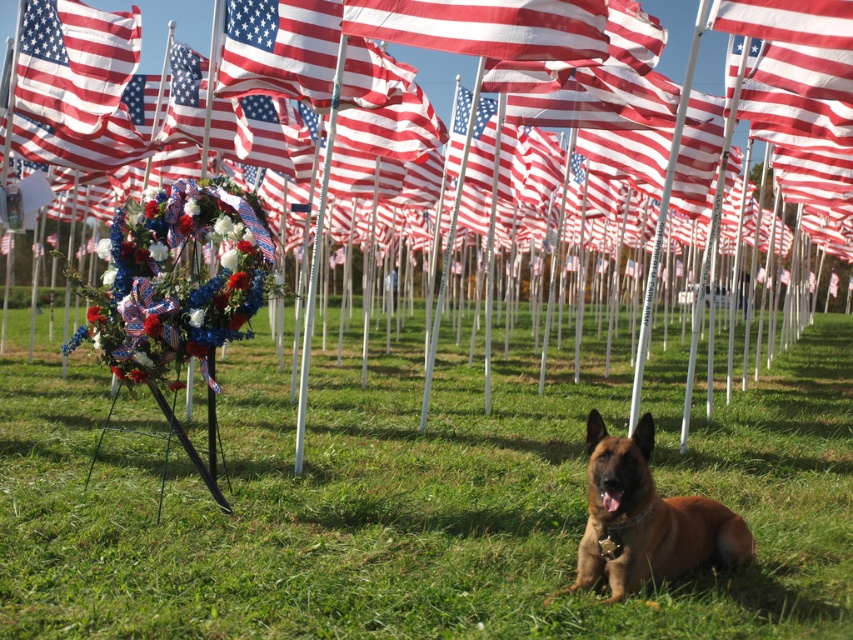
Question: Can you confirm if green grass at center is thinner than red/white striped flag at center?

Choices:
 (A) no
 (B) yes

Answer: (A)

Question: Which of these objects is positioned farthest from the red/white striped flag at center?

Choices:
 (A) green grass at center
 (B) brown fur dog at lower right
 (C) matte fabric flag at upper left

Answer: (A)

Question: Does red/white striped flag at center have a greater width compared to red-white-and-blue fabric flag at center?

Choices:
 (A) yes
 (B) no

Answer: (A)

Question: Which of the following is the closest to the observer?

Choices:
 (A) red-white-striped flag at center
 (B) red/white striped flag at center
 (C) brown fur dog at lower right

Answer: (C)

Question: Based on their relative distances, which object is farther from the green grass at center?

Choices:
 (A) matte white flag at upper left
 (B) red/white striped flag at center

Answer: (B)

Question: Does brown fur dog at lower right appear over matte fabric flag at upper left?

Choices:
 (A) no
 (B) yes

Answer: (A)